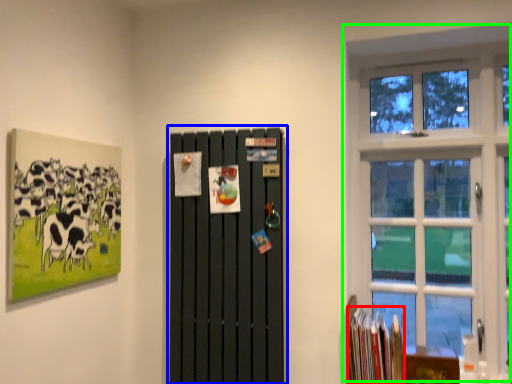
Question: Which object is the closest to the book (highlighted by a red box)? Choose among these: barn door (highlighted by a blue box) or window (highlighted by a green box).

Choices:
 (A) barn door
 (B) window

Answer: (A)